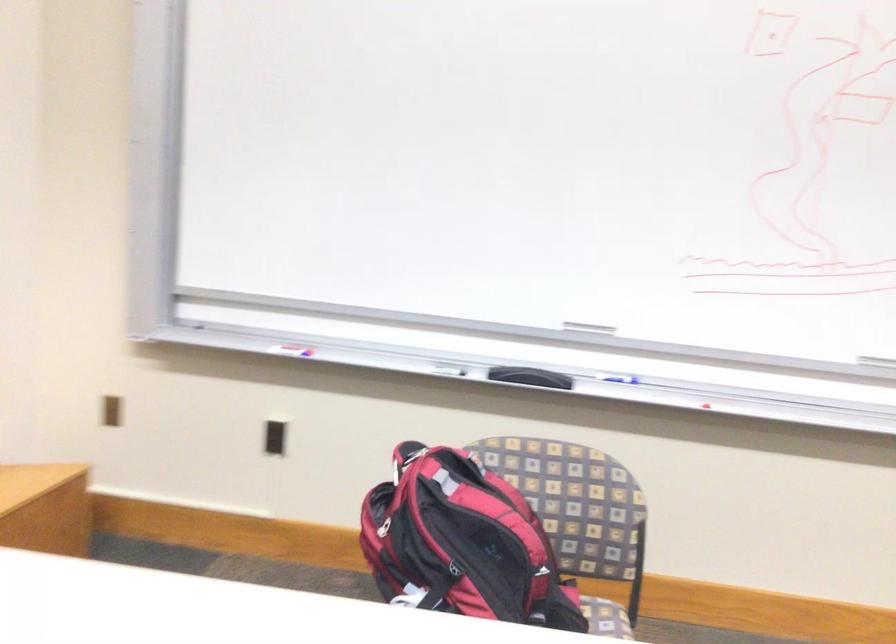
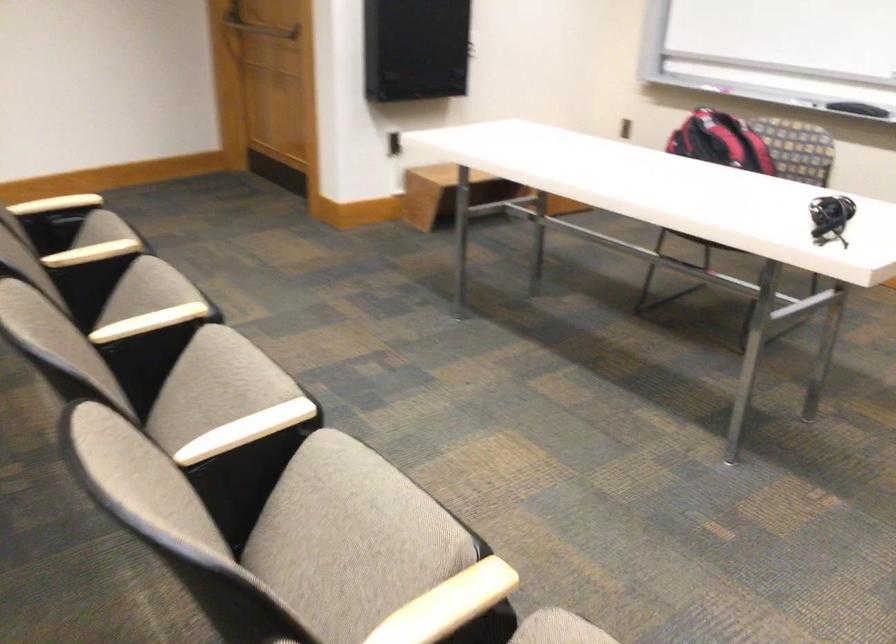
Question: I am providing you with two images of the same scene from different viewpoints. After the viewpoint changes to image2, which objects are now occluded?

Choices:
 (A) blue paper guide
 (B) small black device
 (C) door push bar
 (D) chair sitting surface

Answer: (D)